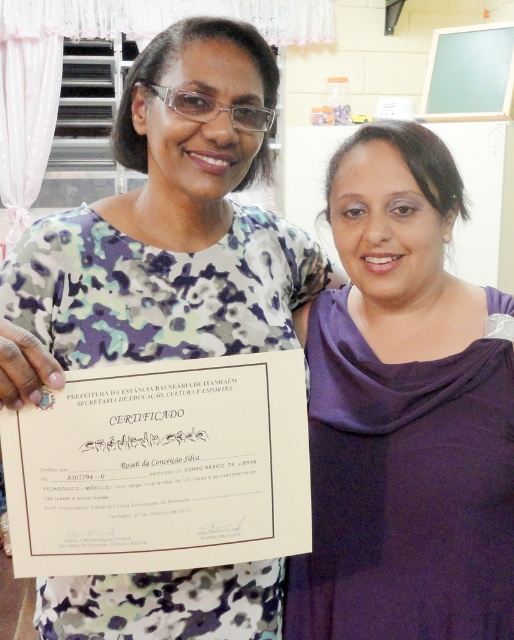
Looking at this image, you are a photographer who needs to decide which outfit to recommend for a formal event. Both the purple matte dress at center and the camouflage fabric shirt at center are available. Considering their thickness, which one would be more appropriate for a formal setting?

The purple matte dress at center is thinner than the camouflage fabric shirt at center, so the purple matte dress at center would be more appropriate for a formal setting as it has a sleeker appearance due to its thinner material.

You are a photographer standing in front of the scene described. You want to take a closeup photo of the purple matte dress at center without including the certificate. Can you move closer to the dress to achieve this? Explain your reasoning based on the distance provided.

The purple matte dress at center is 89.59 centimeters away from the viewer. If you move closer than this distance, you can take a closeup photo of the dress without including the certificate, as the certificate is held by the woman on the left and would be out of frame when focusing on the dress at closer proximity.